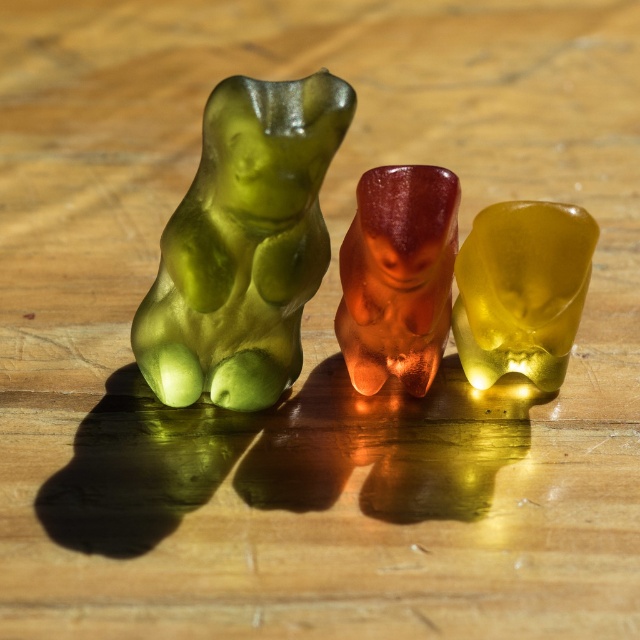
You are arranging candies on a wooden table. You have a green translucent bear at center and a translucent yellow bear at center. If you want to place a new candy between them, where should you position it?

The new candy should be placed between the green translucent bear at center and the translucent yellow bear at center, as the green translucent bear at center is to the left of the translucent yellow bear at center.

You are arranging candies on a table and have two candies in front of you. You have a green translucent bear at center and a translucent amber bear at center. Which candy takes up more space on the table?

The green translucent bear at center takes up more space on the table because it is bigger than the translucent amber bear at center.

You are arranging candies on a wooden table. You have a translucent amber bear at center and a translucent yellow bear at center. According to the image, which candy is placed higher on the table?

The translucent amber bear at center is located above the translucent yellow bear at center, so it is placed higher on the table.